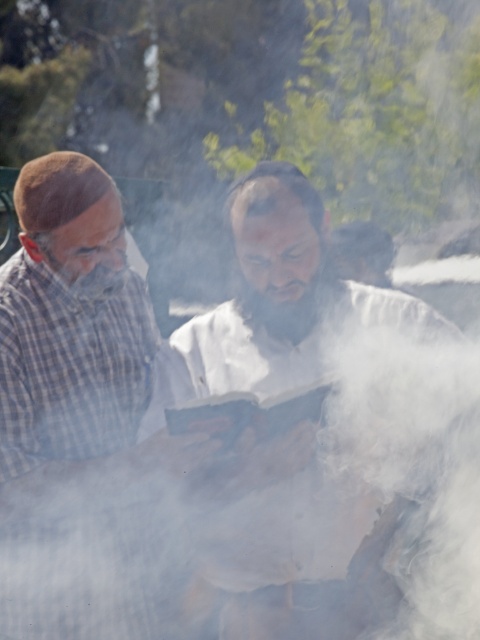
Does white matte book at center come behind plaid fabric shirt at left?

No, white matte book at center is closer to the viewer.

Which of these two, white matte book at center or plaid fabric shirt at left, stands taller?

Standing taller between the two is white matte book at center.

Between point (247, 243) and point (1, 310), which one is positioned behind?

Point (1, 310)

You are a GUI agent. You are given a task and a screenshot of the screen. Output one action in this format:
    pyautogui.click(x=<x>, y=<y>)
    Task: Click on the white matte book at center
    This screenshot has width=480, height=640.
    Given the screenshot: What is the action you would take?
    pyautogui.click(x=319, y=435)